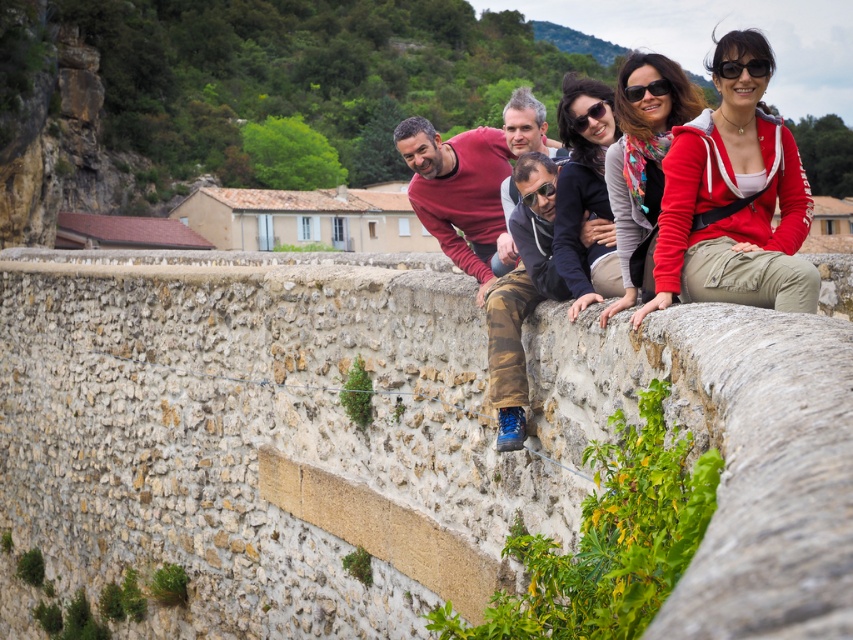
In the scene, there are two eyewear items present. The black plastic sunglasses at upper right and the black plastic goggles at center. Which of these two items is positioned more to the right side of the image?

The black plastic sunglasses at upper right is positioned more to the right side of the image because it is located to the right of the black plastic goggles at center.

You are standing at the origin of the coordinate system. You see a point at coordinates (711, 192). What object is located at that point?

The point at coordinates (711, 192) corresponds to the red hoodie at center.